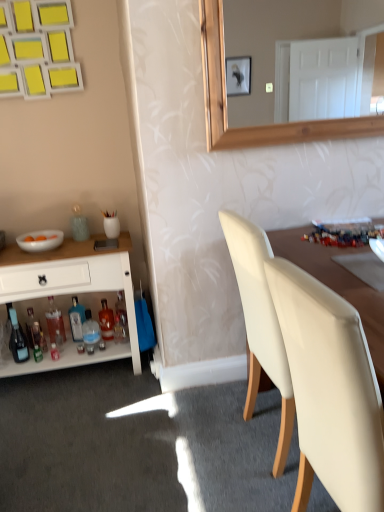
Question: Does white glossy bowl at left touch shiny glass bottle at lower left, which ranks as the 7th bottle in right-to-left order?

Choices:
 (A) yes
 (B) no

Answer: (B)

Question: Considering the relative sizes of white glossy bowl at left and shiny glass bottle at lower left, the first bottle when ordered from left to right, in the image provided, is white glossy bowl at left smaller than shiny glass bottle at lower left, the first bottle when ordered from left to right,?

Choices:
 (A) no
 (B) yes

Answer: (B)

Question: Is white glossy bowl at left closer to the viewer compared to shiny glass bottle at lower left, which ranks as the 7th bottle in right-to-left order?

Choices:
 (A) no
 (B) yes

Answer: (B)

Question: From a real-world perspective, is white glossy bowl at left over shiny glass bottle at lower left, the first bottle when ordered from left to right?

Choices:
 (A) no
 (B) yes

Answer: (B)

Question: From the image's perspective, would you say white glossy bowl at left is positioned over shiny glass bottle at lower left, which ranks as the 7th bottle in right-to-left order?

Choices:
 (A) yes
 (B) no

Answer: (A)

Question: Is white glossy bowl at left positioned with its back to shiny glass bottle at lower left, which ranks as the 7th bottle in right-to-left order?

Choices:
 (A) no
 (B) yes

Answer: (A)

Question: Is translucent glass bottle at lower left, placed as the second bottle when sorted from right to left, at the left side of translucent glass bottle at lower left, the 2th bottle from the left?

Choices:
 (A) yes
 (B) no

Answer: (B)

Question: Can you confirm if translucent glass bottle at lower left, placed as the second bottle when sorted from right to left, is shorter than translucent glass bottle at lower left, the 2th bottle from the left?

Choices:
 (A) yes
 (B) no

Answer: (A)

Question: Can you see translucent glass bottle at lower left, placed as the second bottle when sorted from right to left, touching translucent glass bottle at lower left, the 2th bottle from the left?

Choices:
 (A) yes
 (B) no

Answer: (B)

Question: Is translucent glass bottle at lower left, placed as the second bottle when sorted from right to left, to the right of translucent glass bottle at lower left, positioned as the sixth bottle in right-to-left order, from the viewer's perspective?

Choices:
 (A) no
 (B) yes

Answer: (B)

Question: Is translucent glass bottle at lower left, the 6th bottle positioned from the left, taller than translucent glass bottle at lower left, the 2th bottle from the left?

Choices:
 (A) yes
 (B) no

Answer: (B)

Question: Is the position of translucent glass bottle at lower left, the 6th bottle positioned from the left, less distant than that of translucent glass bottle at lower left, the 2th bottle from the left?

Choices:
 (A) no
 (B) yes

Answer: (A)

Question: From the image's perspective, is translucent glass bottle at lower left, the 6th bottle positioned from the left, under white glossy cabinet at left?

Choices:
 (A) no
 (B) yes

Answer: (B)